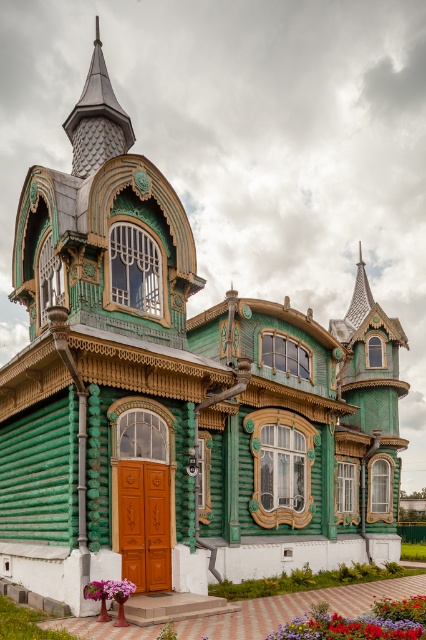
Question: Does shiny dark gray spire at upper center appear on the left side of pink matte flower at lower center?

Choices:
 (A) yes
 (B) no

Answer: (A)

Question: Which point is closer to the camera taking this photo?

Choices:
 (A) (129, 592)
 (B) (117, 131)
 (C) (331, 620)

Answer: (C)

Question: Is vivid red petals at lower center above pink matte flower at lower center?

Choices:
 (A) no
 (B) yes

Answer: (A)

Question: Does vivid red petals at lower center have a smaller size compared to pink matte flower at lower center?

Choices:
 (A) no
 (B) yes

Answer: (A)

Question: Considering the real-world distances, which object is farthest from the pink matte flower at lower center?

Choices:
 (A) vivid red petals at lower center
 (B) shiny dark gray spire at upper center

Answer: (B)

Question: Based on their relative distances, which object is nearer to the vivid red petals at lower center?

Choices:
 (A) pink matte flower at lower center
 (B) shiny dark gray spire at upper center

Answer: (A)